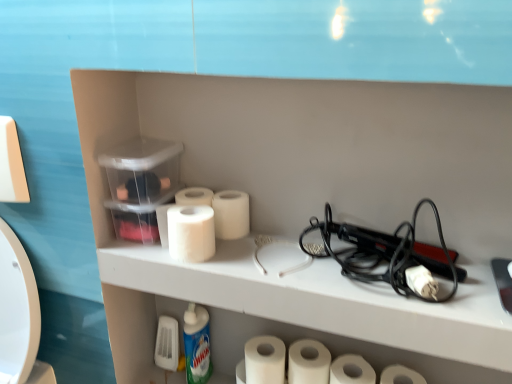
This screenshot has height=384, width=512. I want to click on vacant area situated to the left side of white matte toilet paper at center, placed as the 2th toilet paper when sorted from right to left, so click(359, 282).